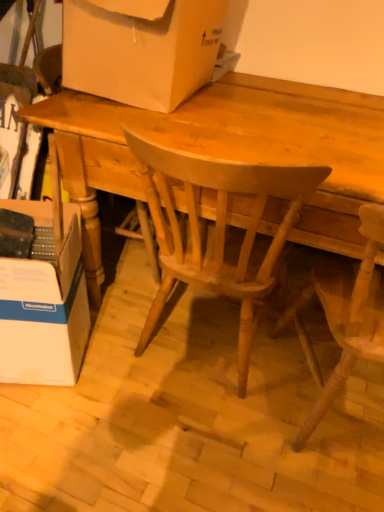
Question: From the image's perspective, does wooden chair at center, arranged as the first chair when viewed from the right, appear higher than light brown wood chair at center, the first chair viewed from the left?

Choices:
 (A) no
 (B) yes

Answer: (A)

Question: Considering the relative sizes of wooden chair at center, arranged as the first chair when viewed from the right, and light brown wood chair at center, the first chair viewed from the left, in the image provided, is wooden chair at center, arranged as the first chair when viewed from the right, bigger than light brown wood chair at center, the first chair viewed from the left,?

Choices:
 (A) no
 (B) yes

Answer: (A)

Question: Does wooden chair at center, which appears as the second chair when viewed from the left, have a lesser height compared to light brown wood chair at center, the first chair viewed from the left?

Choices:
 (A) no
 (B) yes

Answer: (B)

Question: Is wooden chair at center, arranged as the first chair when viewed from the right, aimed at light brown wood chair at center, the first chair viewed from the left?

Choices:
 (A) yes
 (B) no

Answer: (B)

Question: From a real-world perspective, does wooden chair at center, which appears as the second chair when viewed from the left, sit lower than light brown wood chair at center, which appears as the second chair when viewed from the right?

Choices:
 (A) yes
 (B) no

Answer: (A)

Question: Considering the relative positions of wooden chair at center, which appears as the second chair when viewed from the left, and light brown wood chair at center, which appears as the second chair when viewed from the right, in the image provided, is wooden chair at center, which appears as the second chair when viewed from the left, in front of light brown wood chair at center, which appears as the second chair when viewed from the right,?

Choices:
 (A) no
 (B) yes

Answer: (B)

Question: Is wooden chair at center, which appears as the second chair when viewed from the left, at the back of matte cardboard box at upper center, acting as the second box starting from the bottom?

Choices:
 (A) no
 (B) yes

Answer: (A)

Question: Is matte cardboard box at upper center, which is the first box in top-to-bottom order, wider than wooden chair at center, which appears as the second chair when viewed from the left?

Choices:
 (A) no
 (B) yes

Answer: (A)

Question: Is matte cardboard box at upper center, which is the first box in top-to-bottom order, at the right side of wooden chair at center, arranged as the first chair when viewed from the right?

Choices:
 (A) yes
 (B) no

Answer: (B)

Question: Considering the relative sizes of matte cardboard box at upper center, which is the first box in top-to-bottom order, and wooden chair at center, which appears as the second chair when viewed from the left, in the image provided, is matte cardboard box at upper center, which is the first box in top-to-bottom order, smaller than wooden chair at center, which appears as the second chair when viewed from the left,?

Choices:
 (A) no
 (B) yes

Answer: (B)

Question: Is matte cardboard box at upper center, acting as the second box starting from the bottom, completely or partially outside of wooden chair at center, arranged as the first chair when viewed from the right?

Choices:
 (A) yes
 (B) no

Answer: (A)

Question: From a real-world perspective, is matte cardboard box at upper center, acting as the second box starting from the bottom, below wooden chair at center, which appears as the second chair when viewed from the left?

Choices:
 (A) no
 (B) yes

Answer: (A)

Question: Is wooden chair at center, which appears as the second chair when viewed from the left, in front of matte cardboard box at upper center, acting as the second box starting from the bottom?

Choices:
 (A) no
 (B) yes

Answer: (B)